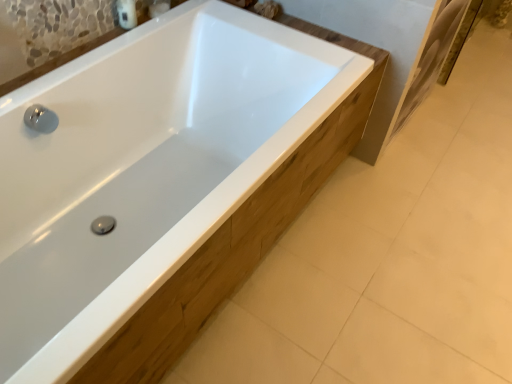
What is the approximate height of white glossy bathtub at center?

The height of white glossy bathtub at center is 23.19 inches.

Image resolution: width=512 pixels, height=384 pixels. What do you see at coordinates (144, 168) in the screenshot?
I see `white glossy bathtub at center` at bounding box center [144, 168].

Find the location of `white glossy bathtub at center`. white glossy bathtub at center is located at coordinates (144, 168).

Measure the distance between point (183, 245) and camera.

Point (183, 245) is 37.44 inches away from camera.

Where is `white glossy bathtub at center`? Image resolution: width=512 pixels, height=384 pixels. white glossy bathtub at center is located at coordinates (144, 168).